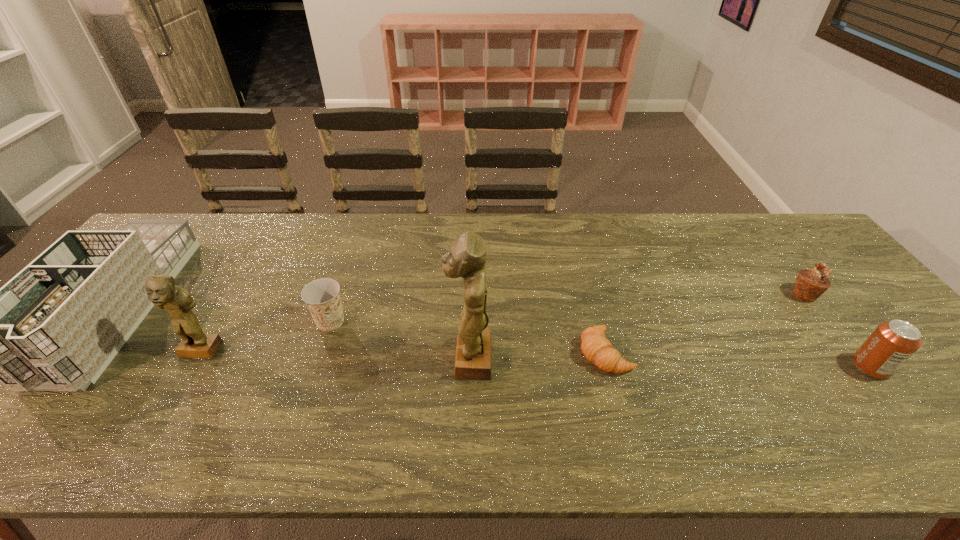
The width and height of the screenshot is (960, 540). What are the coordinates of `muffin` in the screenshot? It's located at (809, 285).

The height and width of the screenshot is (540, 960). I want to click on free location located on the front-facing side of the second object from left to right, so click(168, 407).

At what (x,y) coordinates should I click in order to perform the action: click on vacant space located on the front-facing side of the right figurine. Please return your answer as a coordinate pair (x, y). Looking at the image, I should click on (305, 359).

At what (x,y) coordinates should I click in order to perform the action: click on vacant space situated on the front-facing side of the right figurine. Please return your answer as a coordinate pair (x, y). This screenshot has width=960, height=540. Looking at the image, I should click on (412, 359).

You are a GUI agent. You are given a task and a screenshot of the screen. Output one action in this format:
    pyautogui.click(x=<x>, y=<y>)
    Task: Click on the vacant space located 0.120m on the front-facing side of the right figurine
    
    Given the screenshot: What is the action you would take?
    pyautogui.click(x=399, y=359)

Image resolution: width=960 pixels, height=540 pixels. In order to click on free space located 0.400m on the left of the third object from left to right in this screenshot , I will do `click(161, 321)`.

This screenshot has height=540, width=960. What are the coordinates of `vacant region located 0.140m on the left of the can` in the screenshot? It's located at (796, 367).

Find the location of a particular element. This screenshot has height=540, width=960. vacant space positioned on the right of the third object from right to left is located at coordinates (680, 353).

Identify the location of free space located 0.160m on the back of the muffin. (770, 251).

This screenshot has height=540, width=960. I want to click on object located in the far edge section of the desktop, so click(55, 326).